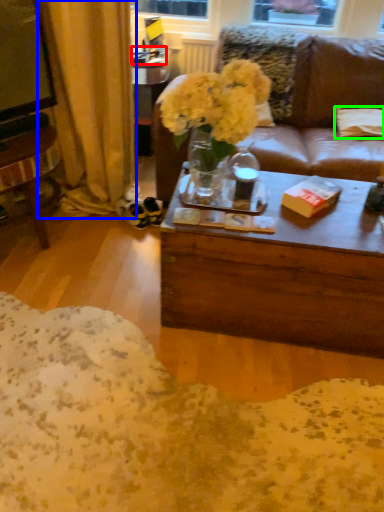
Question: Based on their relative distances, which object is nearer to box (highlighted by a red box)? Choose from curtain (highlighted by a blue box) and pillow (highlighted by a green box).

Choices:
 (A) curtain
 (B) pillow

Answer: (A)